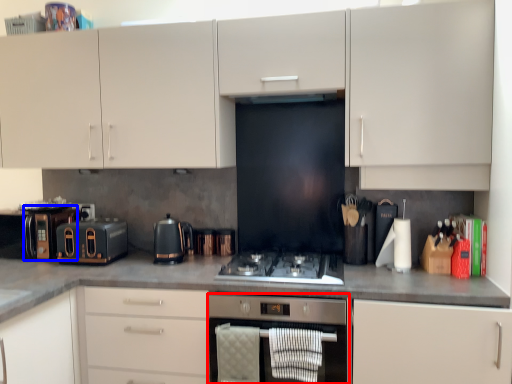
Question: Which of the following is the farthest to the observer, home appliance (highlighted by a red box) or appliance (highlighted by a blue box)?

Choices:
 (A) home appliance
 (B) appliance

Answer: (B)